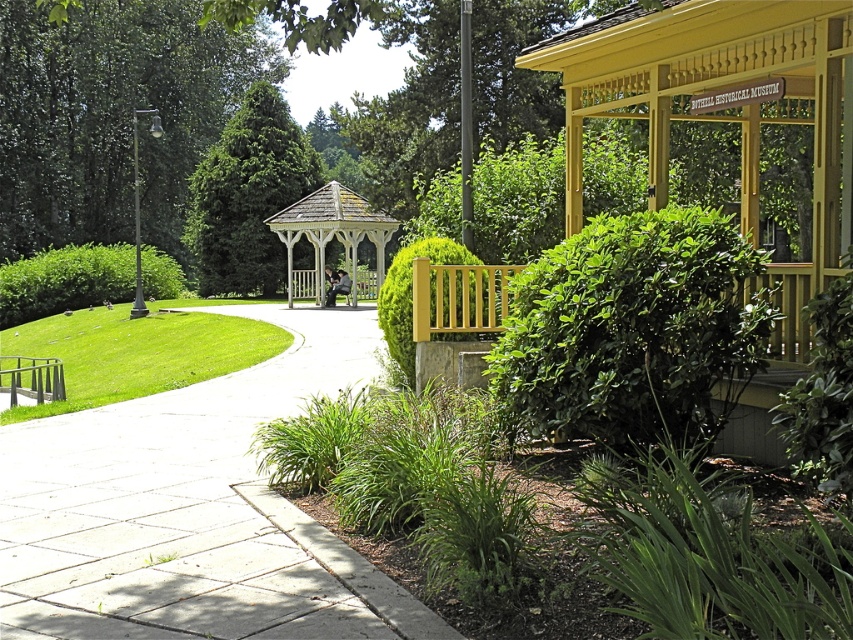
Question: Is green leafy tree at upper left in front of white wooden gazebo at center?

Choices:
 (A) no
 (B) yes

Answer: (A)

Question: Among these objects, which one is farthest from the camera?

Choices:
 (A) green leafy bush at left
 (B) wooden park bench at center
 (C) green leafy tree at upper left
 (D) white wooden gazebo at center

Answer: (C)

Question: Is green leafy tree at upper left to the left of green matte fence at center from the viewer's perspective?

Choices:
 (A) yes
 (B) no

Answer: (A)

Question: In this image, where is concrete at center located relative to green textured tree at center?

Choices:
 (A) above
 (B) below

Answer: (B)

Question: Which object is farther from the camera taking this photo?

Choices:
 (A) green matte fence at center
 (B) green leafy bush at left
 (C) green leafy bush at lower right

Answer: (B)

Question: Which point is farther from the camera taking this photo?

Choices:
 (A) (363, 276)
 (B) (329, 300)

Answer: (A)